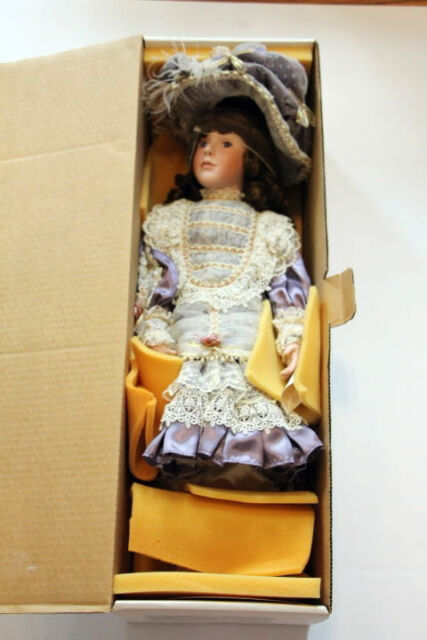
Identify the location of box. (64, 339).